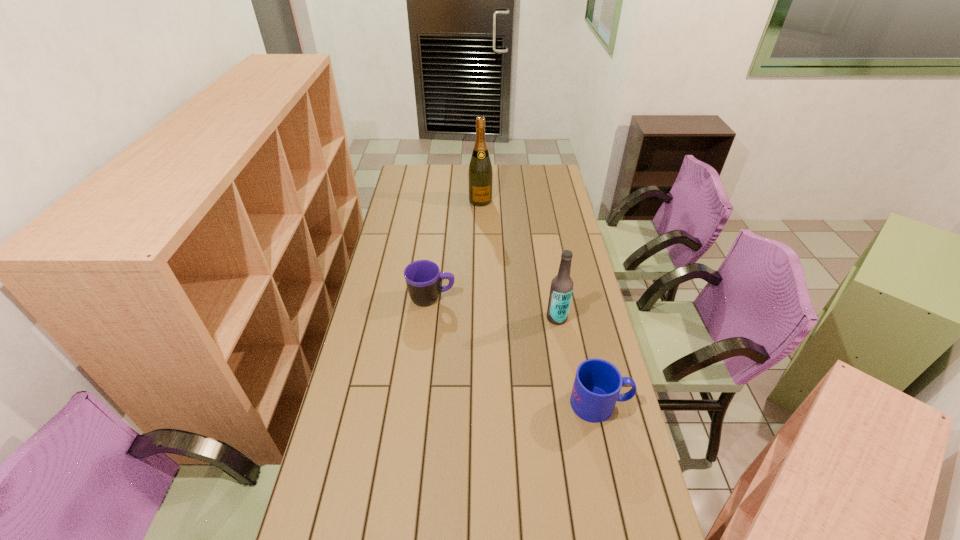
Identify the location of free spot located 0.140m on the label of the second tallest object. (519, 339).

Image resolution: width=960 pixels, height=540 pixels. I want to click on blank area located on the front-facing side of the wine bottle, so click(490, 237).

This screenshot has width=960, height=540. In order to click on free space located 0.250m on the front-facing side of the wine bottle in this screenshot , I will do `click(490, 237)`.

The image size is (960, 540). What are the coordinates of `vacant space located 0.170m on the front-facing side of the wine bottle` in the screenshot? It's located at (487, 226).

You are a GUI agent. You are given a task and a screenshot of the screen. Output one action in this format:
    pyautogui.click(x=<x>, y=<y>)
    Task: Click on the object that is at the left edge
    The image size is (960, 540).
    Given the screenshot: What is the action you would take?
    pyautogui.click(x=423, y=278)

In order to click on mug that is at the right edge in this screenshot , I will do `click(597, 384)`.

I want to click on beer bottle present at the right edge, so click(x=561, y=289).

In the image, there is a desktop. Where is `vacant space at the far edge`? Image resolution: width=960 pixels, height=540 pixels. vacant space at the far edge is located at coordinates (493, 179).

This screenshot has height=540, width=960. I want to click on vacant region at the left edge, so click(x=388, y=238).

Locate an element on the screen. free space at the right edge is located at coordinates (588, 334).